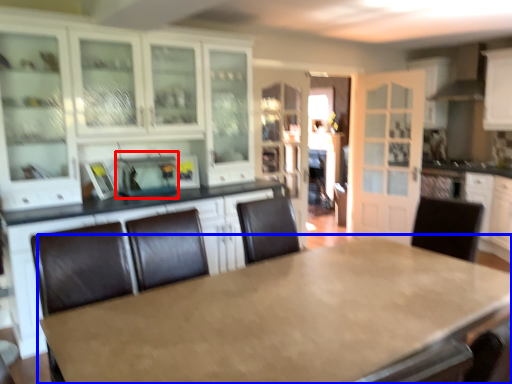
Question: Which point is further to the camera, appliance (highlighted by a red box) or table (highlighted by a blue box)?

Choices:
 (A) appliance
 (B) table

Answer: (A)